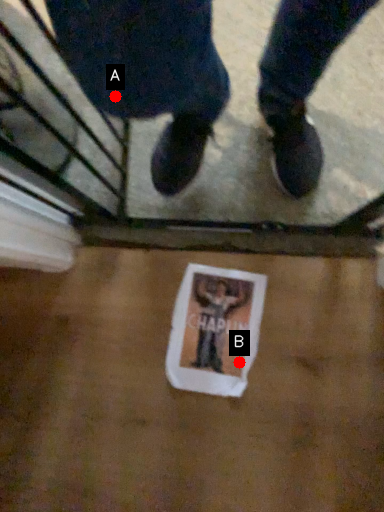
Question: Two points are circled on the image, labeled by A and B beside each circle. Which point appears farthest from the camera in this image?

Choices:
 (A) A is further
 (B) B is further

Answer: (B)